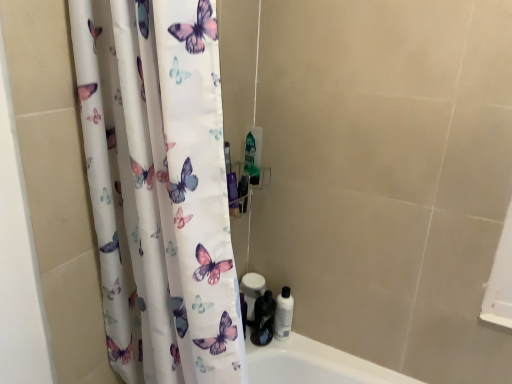
Question: Does white matte toilet paper at lower center have a lesser width compared to shiny black bottle at lower right, the first toiletry viewed from the left?

Choices:
 (A) no
 (B) yes

Answer: (B)

Question: Is shiny black bottle at lower right, positioned as the 2th toiletry in right-to-left order, surrounded by white matte toilet paper at lower center?

Choices:
 (A) yes
 (B) no

Answer: (B)

Question: From the image's perspective, is white matte toilet paper at lower center located above shiny black bottle at lower right, positioned as the 2th toiletry in right-to-left order?

Choices:
 (A) no
 (B) yes

Answer: (B)

Question: Does white matte toilet paper at lower center have a larger size compared to shiny black bottle at lower right, the first toiletry viewed from the left?

Choices:
 (A) yes
 (B) no

Answer: (A)

Question: Is white matte toilet paper at lower center closer to camera compared to shiny black bottle at lower right, positioned as the 2th toiletry in right-to-left order?

Choices:
 (A) no
 (B) yes

Answer: (A)

Question: Considering the relative positions of white matte toilet paper at lower center and shiny black bottle at lower right, positioned as the 2th toiletry in right-to-left order, in the image provided, is white matte toilet paper at lower center to the right of shiny black bottle at lower right, positioned as the 2th toiletry in right-to-left order, from the viewer's perspective?

Choices:
 (A) yes
 (B) no

Answer: (B)

Question: Could you tell me if white glossy bottle at lower right, which ranks as the 2th toiletry in left-to-right order, is turned towards white matte toilet paper at lower center?

Choices:
 (A) yes
 (B) no

Answer: (B)

Question: Is white glossy bottle at lower right, which is the 1th toiletry from right to left, shorter than white matte toilet paper at lower center?

Choices:
 (A) yes
 (B) no

Answer: (A)

Question: Are white glossy bottle at lower right, which ranks as the 2th toiletry in left-to-right order, and white matte toilet paper at lower center located far from each other?

Choices:
 (A) yes
 (B) no

Answer: (B)

Question: Does white glossy bottle at lower right, which is the 1th toiletry from right to left, appear on the left side of white matte toilet paper at lower center?

Choices:
 (A) yes
 (B) no

Answer: (B)

Question: Does white glossy bottle at lower right, which is the 1th toiletry from right to left, contain white matte toilet paper at lower center?

Choices:
 (A) no
 (B) yes

Answer: (A)

Question: Is white glossy bottle at lower right, which ranks as the 2th toiletry in left-to-right order, at the right side of white matte toilet paper at lower center?

Choices:
 (A) no
 (B) yes

Answer: (B)

Question: Does shiny black bottle at lower right, the first toiletry viewed from the left, have a larger size compared to white matte toilet paper at lower center?

Choices:
 (A) yes
 (B) no

Answer: (B)